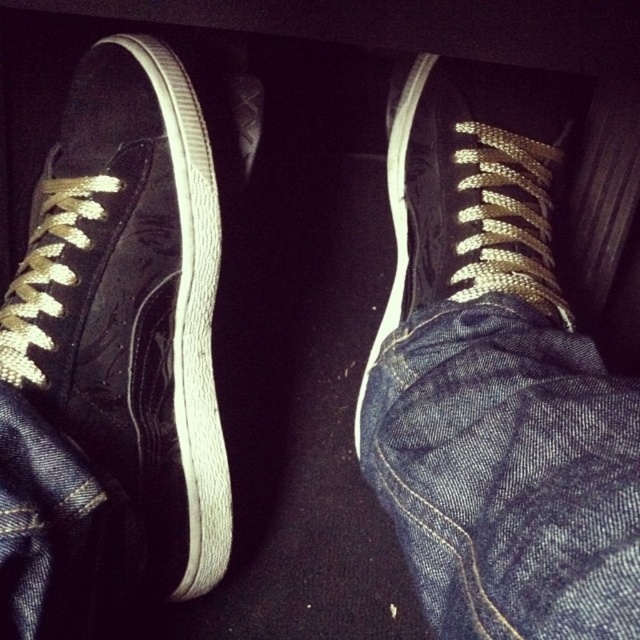
You are standing in a dimly lit room and see a pair of black high top sneakers with gold laces. There is a point at coordinate point (131,298). Is this point located on the suede part of the shoe?

The suede black shoe at left is represented by point (131,298), so yes, the point is located on the suede part of the shoe.